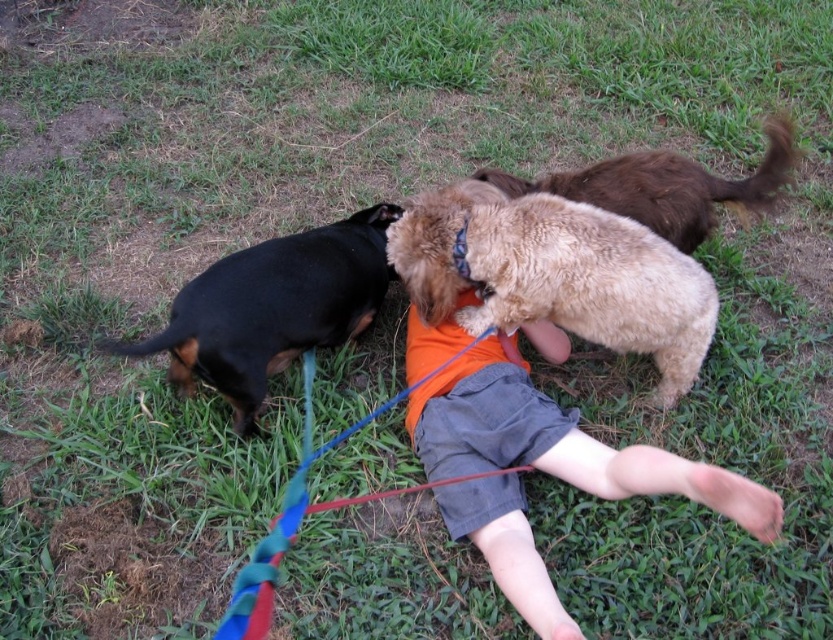
Question: Does orange t-shirt at center lie in front of multicolored fabric leash at center?

Choices:
 (A) yes
 (B) no

Answer: (A)

Question: Which object appears closest to the camera in this image?

Choices:
 (A) fuzzy beige dog at center
 (B) orange t-shirt at center
 (C) black smooth coat dog at left
 (D) brown fluffy dog at upper right

Answer: (B)

Question: Which object appears farthest from the camera in this image?

Choices:
 (A) black smooth coat dog at left
 (B) fuzzy beige dog at center
 (C) brown fluffy dog at upper right

Answer: (C)

Question: Which point is closer to the camera?

Choices:
 (A) fuzzy beige dog at center
 (B) multicolored fabric leash at center
 (C) black smooth coat dog at left
 (D) orange t-shirt at center

Answer: (D)

Question: Is orange t-shirt at center bigger than brown fluffy dog at upper right?

Choices:
 (A) no
 (B) yes

Answer: (B)

Question: Can you confirm if orange t-shirt at center is wider than fuzzy beige dog at center?

Choices:
 (A) yes
 (B) no

Answer: (B)